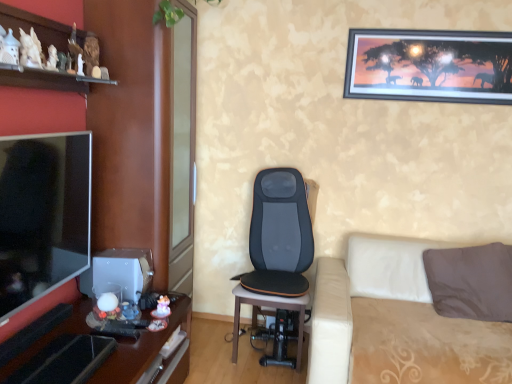
This screenshot has height=384, width=512. What are the coordinates of `white ceramic figurines at upper left` in the screenshot? It's located at (49, 80).

At what (x,y) coordinates should I click in order to perform the action: click on beige fabric studio couch at lower right. Please return your answer as a coordinate pair (x, y). The image size is (512, 384). Looking at the image, I should click on (396, 322).

From the picture: What is the approximate width of matte black tv at left?

3.99 inches.

Measure the distance between matte wood entertainment center at left and camera.

matte wood entertainment center at left and camera are 1.71 meters apart.

Image resolution: width=512 pixels, height=384 pixels. Identify the location of white ceramic figurines at upper left. (49, 80).

How many degrees apart are the facing directions of matte black tv at left and metallic-framed picture at upper right?

They differ by 89.4 degrees in their facing directions.

Which point is more distant from viewer, (31,145) or (432,47)?

Point (432,47)

Which object is thinner, matte black tv at left or metallic-framed picture at upper right?

metallic-framed picture at upper right.

Is the depth of black leather massage chair at center greater than that of beige fabric studio couch at lower right?

Yes.

Are black leather massage chair at center and beige fabric studio couch at lower right located far from each other?

No, black leather massage chair at center is not far from beige fabric studio couch at lower right.

From a real-world perspective, which is physically above, black leather massage chair at center or beige fabric studio couch at lower right?

black leather massage chair at center.

From the image's perspective, which object appears higher, black leather massage chair at center or beige fabric studio couch at lower right?

From the image's view, black leather massage chair at center is above.

From a real-world perspective, between matte wood entertainment center at left and black leather massage chair at center, who is vertically higher?

In real-world perspective, matte wood entertainment center at left is above.

Is matte wood entertainment center at left facing towards black leather massage chair at center?

Yes, matte wood entertainment center at left is turned towards black leather massage chair at center.

Based on their positions, is matte wood entertainment center at left located to the left or right of black leather massage chair at center?

Clearly, matte wood entertainment center at left is on the left of black leather massage chair at center in the image.

Is matte wood entertainment center at left positioned before black leather massage chair at center?

Yes, matte wood entertainment center at left is closer to the camera.

Would you say white ceramic figurines at upper left contains matte wood entertainment center at left?

No, matte wood entertainment center at left is not inside white ceramic figurines at upper left.

Based on the photo, is white ceramic figurines at upper left aimed at matte wood entertainment center at left?

No, white ceramic figurines at upper left is not facing towards matte wood entertainment center at left.

Based on their positions, is white ceramic figurines at upper left located to the left or right of matte wood entertainment center at left?

In the image, white ceramic figurines at upper left appears on the left side of matte wood entertainment center at left.

Which object is further away from the camera, matte wood entertainment center at left or matte white figurine at lower center?

matte white figurine at lower center is further away from the camera.

Is matte wood entertainment center at left inside or outside of matte white figurine at lower center?

matte wood entertainment center at left cannot be found inside matte white figurine at lower center.

Between point (159, 95) and point (163, 311), which one is positioned in front?

Positioned in front is point (163, 311).

Is matte wood entertainment center at left positioned with its back to matte white figurine at lower center?

matte wood entertainment center at left does not have its back to matte white figurine at lower center.

Considering the relative sizes of matte black tv at left and matte wood entertainment center at left in the image provided, is matte black tv at left bigger than matte wood entertainment center at left?

Actually, matte black tv at left might be smaller than matte wood entertainment center at left.

Which object is more forward, matte black tv at left or matte wood entertainment center at left?

matte black tv at left is in front.

Does matte black tv at left have a lesser width compared to matte wood entertainment center at left?

Yes, matte black tv at left is thinner than matte wood entertainment center at left.

Which is behind, point (390, 294) or point (94, 371)?

The point (390, 294) is more distant.

Choose the correct answer: Is beige fabric studio couch at lower right inside wooden glossy desk at left or outside it?

beige fabric studio couch at lower right cannot be found inside wooden glossy desk at left.

How different are the orientations of beige fabric studio couch at lower right and wooden glossy desk at left in degrees?

The angular difference between beige fabric studio couch at lower right and wooden glossy desk at left is 90 degrees.

From the image's perspective, is beige fabric studio couch at lower right under wooden glossy desk at left?

No, from the image's perspective, beige fabric studio couch at lower right is not beneath wooden glossy desk at left.

The height and width of the screenshot is (384, 512). I want to click on television in front of the metallic-framed picture at upper right, so click(x=42, y=214).

Locate an element on the screen. chair on the left of beige fabric studio couch at lower right is located at coordinates pos(278,249).

Based on their spatial positions, is white ceramic figurines at upper left or wooden glossy desk at left closer to matte black tv at left?

wooden glossy desk at left is positioned closer to the anchor matte black tv at left.

Looking at the image, which one is located further to matte black tv at left, wooden glossy desk at left or matte wood entertainment center at left?

Based on the image, wooden glossy desk at left appears to be further to matte black tv at left.

Based on their spatial positions, is white ceramic figurines at upper left or black leather massage chair at center further from matte wood entertainment center at left?

black leather massage chair at center is further to matte wood entertainment center at left.

Estimate the real-world distances between objects in this image. Which object is closer to wooden glossy desk at left, beige fabric studio couch at lower right or metallic-framed picture at upper right?

beige fabric studio couch at lower right is closer to wooden glossy desk at left.

Based on their spatial positions, is beige fabric studio couch at lower right or wooden glossy desk at left further from matte wood entertainment center at left?

Based on the image, beige fabric studio couch at lower right appears to be further to matte wood entertainment center at left.

From the picture: Estimate the real-world distances between objects in this image. Which object is closer to black leather massage chair at center, matte white figurine at lower center or metallic-framed picture at upper right?

matte white figurine at lower center lies closer to black leather massage chair at center than the other object.

From the image, which object appears to be farther from beige fabric studio couch at lower right, black leather massage chair at center or wooden glossy desk at left?

wooden glossy desk at left.

Based on their spatial positions, is white ceramic figurines at upper left or metallic-framed picture at upper right closer to matte black tv at left?

Based on the image, white ceramic figurines at upper left appears to be nearer to matte black tv at left.

You are a GUI agent. You are given a task and a screenshot of the screen. Output one action in this format:
    pyautogui.click(x=<x>, y=<y>)
    Task: Click on the toy between white ceramic figurines at upper left and beige fabric studio couch at lower right from left to right
    The image size is (512, 384).
    Given the screenshot: What is the action you would take?
    pyautogui.click(x=162, y=308)

This screenshot has width=512, height=384. What are the coordinates of `chair between matte wood entertainment center at left and metallic-framed picture at upper right from left to right` in the screenshot? It's located at (278, 249).

Identify the location of entertainment center between white ceramic figurines at upper left and matte white figurine at lower center vertically. The width and height of the screenshot is (512, 384). (131, 133).

Locate an element on the screen. Image resolution: width=512 pixels, height=384 pixels. toy between wooden glossy desk at left and metallic-framed picture at upper right in the horizontal direction is located at coordinates (162, 308).